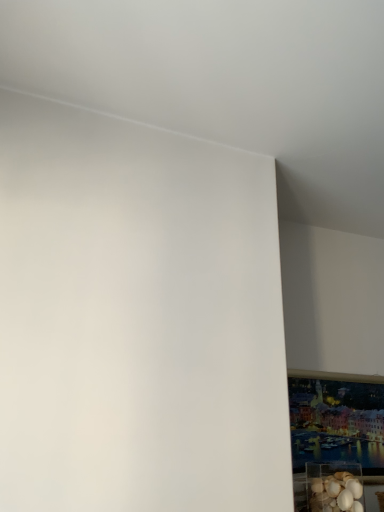
Question: Should I look upward or downward to see translucent plastic container at lower right?

Choices:
 (A) up
 (B) down

Answer: (B)